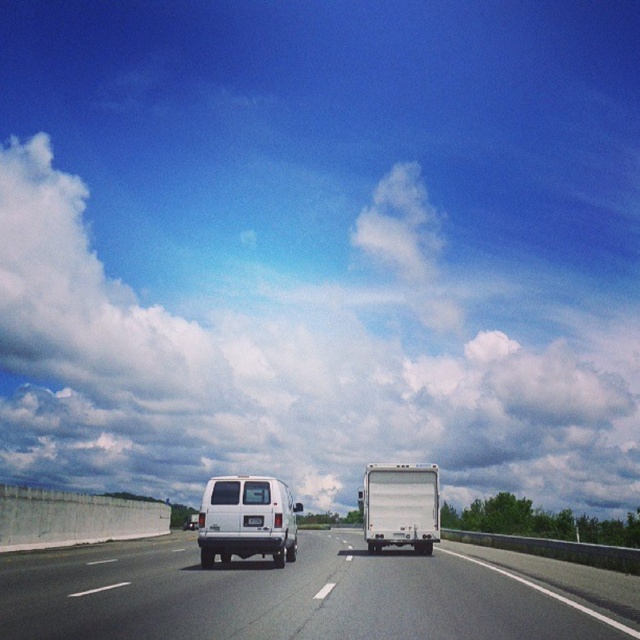
You are a passenger in the vehicle and want to check the license plate number. Which object is closer to the left side of the vehicle, the white matte van at center or the white matte license plate at rear?

The white matte van at center is to the left of the white matte license plate at rear, so the white matte van at center is closer to the left side of the vehicle.

You are a delivery driver who needs to park your vehicle in a parking spot that is exactly as wide as the white glossy van at center. The parking spot has a white matte license plate at rear marked on it. Can your vehicle fit into the parking spot without touching the sides?

The white glossy van at center might be wider than the white matte license plate at rear, so there is uncertainty if the parking spot is wide enough. Check the actual width before parking.

You are a GPS device in a car. The driver wants to exit the highway at the next exit, which is located at point 0.811, 0.380. Is the white matte van at center in your way?

The white matte van at center is located at point [243,518], which is exactly where the exit is. Therefore, the white matte van at center is blocking the exit.